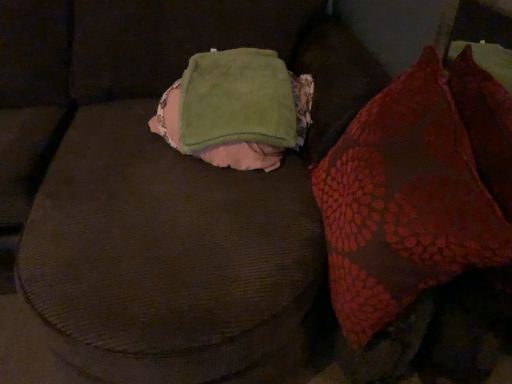
Where is `green soft blanket at center`? green soft blanket at center is located at coordinates (236, 109).

Image resolution: width=512 pixels, height=384 pixels. Describe the element at coordinates (236, 109) in the screenshot. I see `green soft blanket at center` at that location.

Locate an element on the screen. The image size is (512, 384). velvet red pillow at right is located at coordinates (416, 191).

What is the approximate width of velvet red pillow at right?

11.56 inches.

The height and width of the screenshot is (384, 512). What do you see at coordinates (416, 191) in the screenshot?
I see `velvet red pillow at right` at bounding box center [416, 191].

I want to click on green soft blanket at center, so click(x=236, y=109).

Does velvet red pillow at right appear on the left side of green soft blanket at center?

Incorrect, velvet red pillow at right is not on the left side of green soft blanket at center.

Looking at this image, which is behind, velvet red pillow at right or green soft blanket at center?

green soft blanket at center is behind.

Which is closer, (459, 166) or (215, 51)?

Clearly, point (459, 166) is closer to the camera than point (215, 51).

From the image's perspective, is velvet red pillow at right below green soft blanket at center?

Indeed, from the image's perspective, velvet red pillow at right is shown beneath green soft blanket at center.

From a real-world perspective, is velvet red pillow at right located higher than green soft blanket at center?

Actually, velvet red pillow at right is physically below green soft blanket at center in the real world.

Is velvet red pillow at right wider or thinner than green soft blanket at center?

In the image, velvet red pillow at right appears to be more narrow than green soft blanket at center.

Which of these two, velvet red pillow at right or green soft blanket at center, stands shorter?

With less height is green soft blanket at center.

Is velvet red pillow at right smaller than green soft blanket at center?

No, velvet red pillow at right is not smaller than green soft blanket at center.

Consider the image. Can we say velvet red pillow at right lies outside green soft blanket at center?

Absolutely, velvet red pillow at right is external to green soft blanket at center.

Is there a large distance between velvet red pillow at right and green soft blanket at center?

That's not correct — velvet red pillow at right is a little close to green soft blanket at center.

Does velvet red pillow at right turn towards green soft blanket at center?

No, velvet red pillow at right does not turn towards green soft blanket at center.

Can you tell me how much velvet red pillow at right and green soft blanket at center differ in facing direction?

There is a 94-degree angle between the facing directions of velvet red pillow at right and green soft blanket at center.

Where is `throw pillow below the green soft blanket at center (from the image's perspective)`? throw pillow below the green soft blanket at center (from the image's perspective) is located at coordinates (416, 191).

Is green soft blanket at center at the left side of velvet red pillow at right?

Yes, green soft blanket at center is to the left of velvet red pillow at right.

Which object is further away from the camera, green soft blanket at center or velvet red pillow at right?

green soft blanket at center is further away from the camera.

Considering the points (244, 84) and (389, 113), which point is behind, point (244, 84) or point (389, 113)?

Positioned behind is point (244, 84).

From the image's perspective, would you say green soft blanket at center is shown under velvet red pillow at right?

No, from the image's perspective, green soft blanket at center is not beneath velvet red pillow at right.

Based on the photo, from a real-world perspective, between green soft blanket at center and velvet red pillow at right, who is vertically lower?

velvet red pillow at right.

Does green soft blanket at center have a lesser width compared to velvet red pillow at right?

Incorrect, the width of green soft blanket at center is not less than that of velvet red pillow at right.

Considering the relative sizes of green soft blanket at center and velvet red pillow at right in the image provided, is green soft blanket at center shorter than velvet red pillow at right?

Correct, green soft blanket at center is not as tall as velvet red pillow at right.

Can you confirm if green soft blanket at center is smaller than velvet red pillow at right?

Yes, green soft blanket at center is smaller than velvet red pillow at right.

Is green soft blanket at center not inside velvet red pillow at right?

green soft blanket at center is positioned outside velvet red pillow at right.

Is green soft blanket at center next to velvet red pillow at right?

green soft blanket at center and velvet red pillow at right are clearly separated.

Could you tell me if green soft blanket at center is facing velvet red pillow at right?

Yes, green soft blanket at center is turned towards velvet red pillow at right.

This screenshot has height=384, width=512. Find the location of `bean bag chair above the velvet red pillow at right (from the image's perspective)`. bean bag chair above the velvet red pillow at right (from the image's perspective) is located at coordinates pos(236,109).

The height and width of the screenshot is (384, 512). There is a velvet red pillow at right. Find the location of `bean bag chair above it (from a real-world perspective)`. bean bag chair above it (from a real-world perspective) is located at coordinates (236, 109).

The height and width of the screenshot is (384, 512). I want to click on bean bag chair lying on the left of velvet red pillow at right, so click(x=236, y=109).